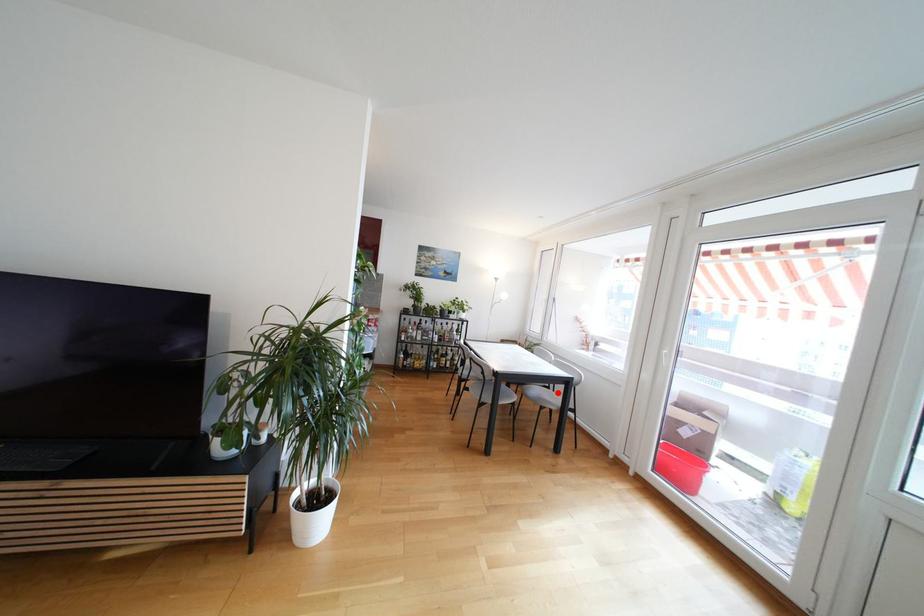
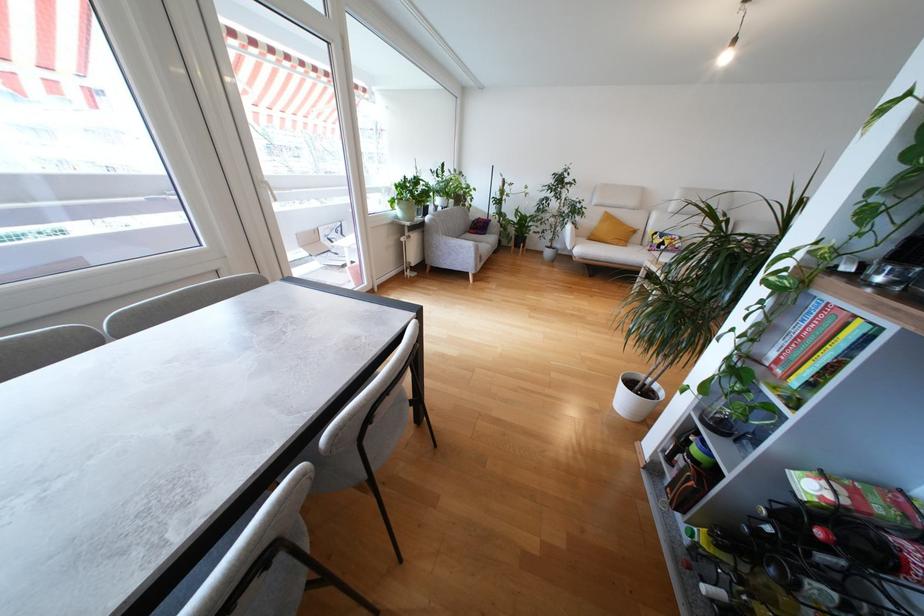
Question: I am providing you with two images of the same scene from different viewpoints. A red point is marked on the first image. At the location where the point appears in image 1, is it still visible in image 2?

Choices:
 (A) Yes
 (B) No

Answer: (B)